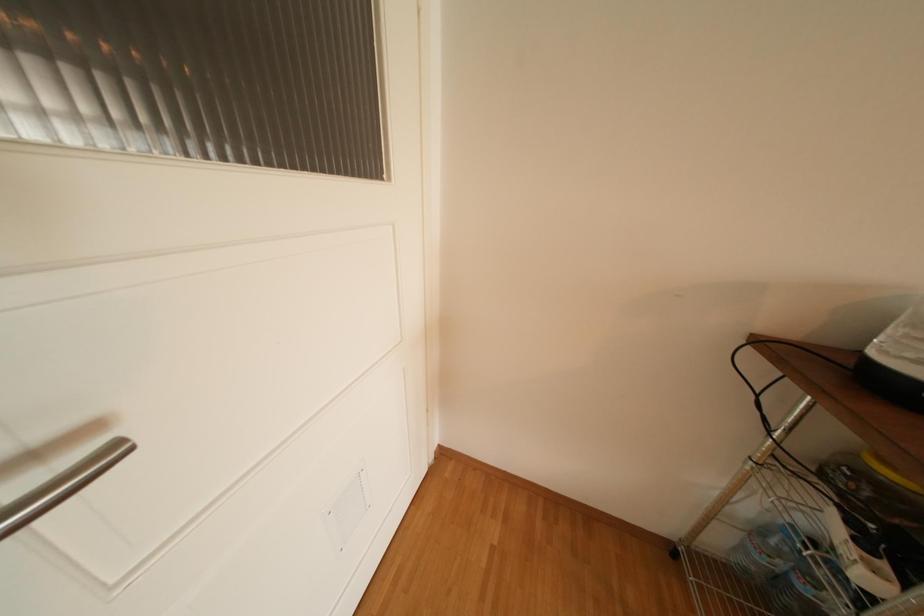
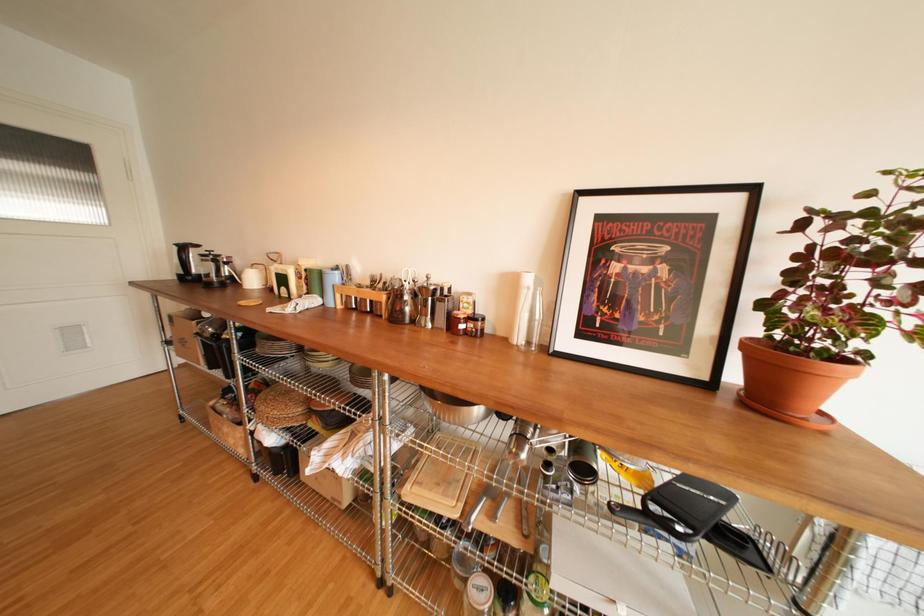
Which direction would the cameraman need to move to produce the second image?

The cameraman moved toward right, backward.